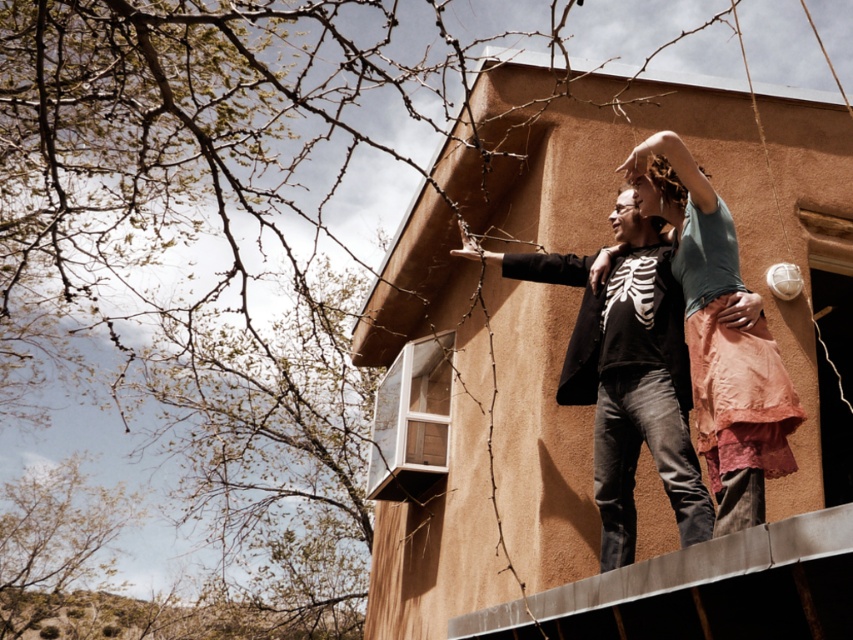
Question: Which point appears farthest from the camera in this image?

Choices:
 (A) (680, 406)
 (B) (751, 333)

Answer: (A)

Question: Is matte black skeleton shirt at center below light blue cotton shirt at center?

Choices:
 (A) yes
 (B) no

Answer: (A)

Question: Which point appears closest to the camera in this image?

Choices:
 (A) (640, 376)
 (B) (756, 401)

Answer: (B)

Question: In this image, where is matte black skeleton shirt at center located relative to light blue cotton shirt at center?

Choices:
 (A) above
 (B) below

Answer: (B)

Question: Can you confirm if matte black skeleton shirt at center is positioned above light blue cotton shirt at center?

Choices:
 (A) yes
 (B) no

Answer: (B)